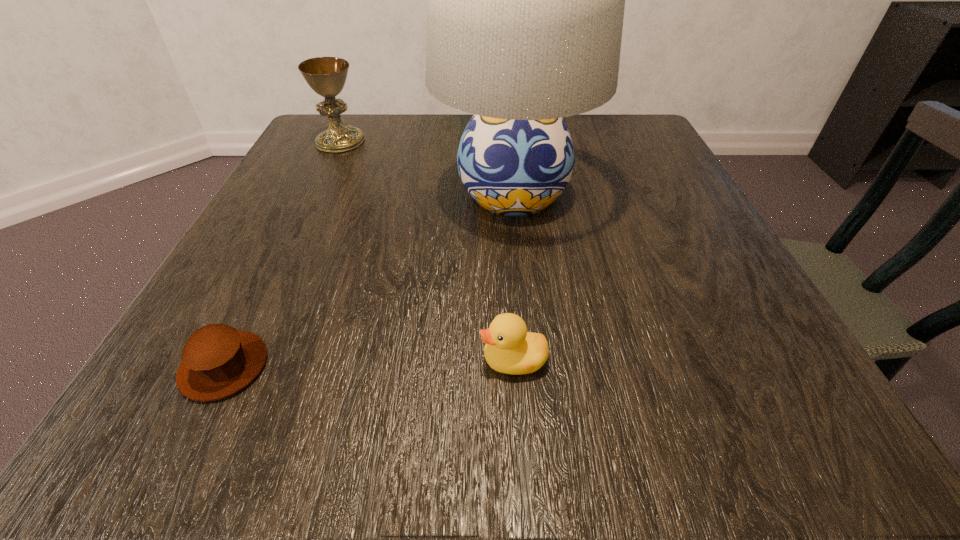
Where is `vacant space at the far edge of the desktop`? This screenshot has width=960, height=540. vacant space at the far edge of the desktop is located at coordinates (419, 116).

This screenshot has height=540, width=960. I want to click on free space at the near edge, so click(x=680, y=441).

Locate an element on the screen. This screenshot has height=540, width=960. blank area at the left edge is located at coordinates (245, 312).

The height and width of the screenshot is (540, 960). I want to click on vacant space at the right edge of the desktop, so click(682, 328).

Where is `vacant space at the far right corner`? vacant space at the far right corner is located at coordinates (589, 128).

This screenshot has width=960, height=540. In order to click on vacant region between the muffin and the second farthest object in this screenshot , I will do `click(369, 280)`.

Identify the location of vacant space that is in between the lampshade and the farthest object. (427, 167).

Find the location of a particular element. free space that is in between the tallest object and the third shortest object is located at coordinates (427, 167).

At what (x,y) coordinates should I click in order to perform the action: click on free space between the second shortest object and the shortest object. Please return your answer as a coordinate pair (x, y). Looking at the image, I should click on (369, 363).

Where is `free spot between the muffin and the tallest object`? This screenshot has width=960, height=540. free spot between the muffin and the tallest object is located at coordinates (369, 280).